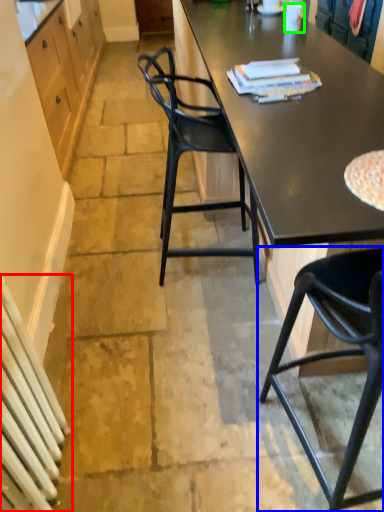
Question: Which object is positioned farthest from radiator (highlighted by a red box)? Select from chair (highlighted by a blue box) and coffee cup (highlighted by a green box).

Choices:
 (A) chair
 (B) coffee cup

Answer: (B)